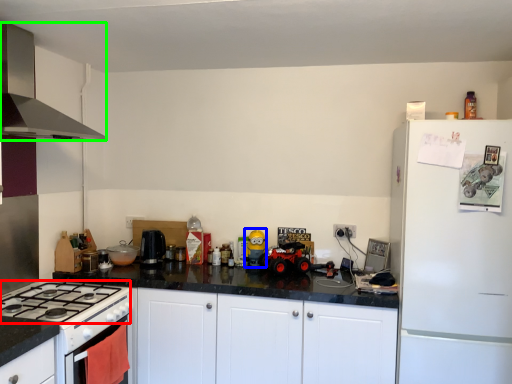
Question: Which object is positioned farthest from gas stove (highlighted by a red box)? Select from toy (highlighted by a blue box) and kitchen appliance (highlighted by a green box).

Choices:
 (A) toy
 (B) kitchen appliance

Answer: (A)